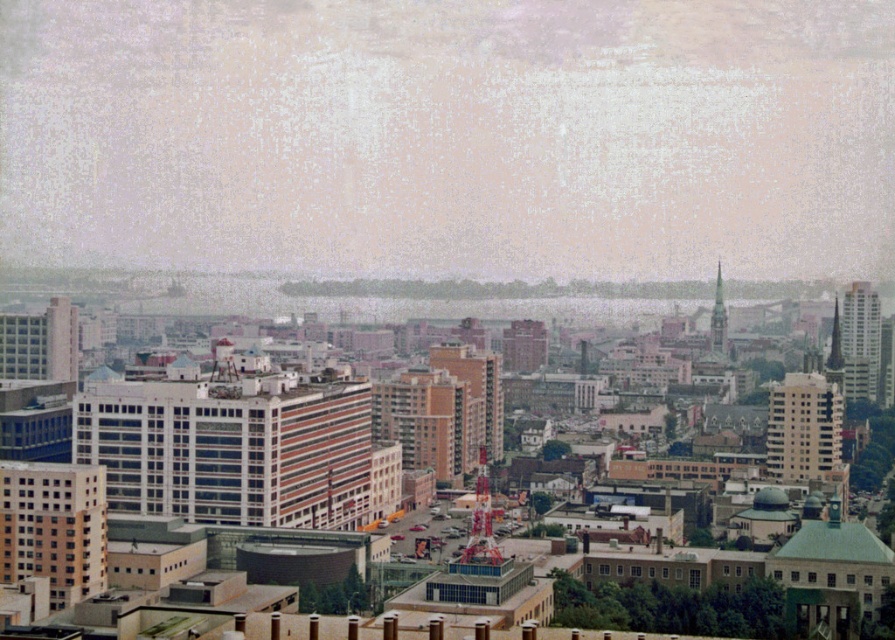
Question: In this image, where is orange brick building at center located relative to smooth gray spire at upper right?

Choices:
 (A) below
 (B) above

Answer: (A)

Question: Is white glass building at center above orange brick building at lower left?

Choices:
 (A) yes
 (B) no

Answer: (A)

Question: Considering the real-world distances, which object is farthest from the orange brick building at lower left?

Choices:
 (A) brown brick building at center
 (B) beige concrete building at center-right
 (C) smooth gray spire at upper right
 (D) smooth glass skyscraper at right

Answer: (D)

Question: Is brown brick building at center thinner than smooth gray spire at upper right?

Choices:
 (A) no
 (B) yes

Answer: (A)

Question: Which object is positioned closest to the brown brick building at center?

Choices:
 (A) beige concrete building at center-right
 (B) white glass building at center
 (C) orange brick building at lower left
 (D) orange brick building at center

Answer: (D)

Question: Which point is closer to the camera taking this photo?

Choices:
 (A) (714, 308)
 (B) (155, 492)
 (C) (484, 349)

Answer: (C)